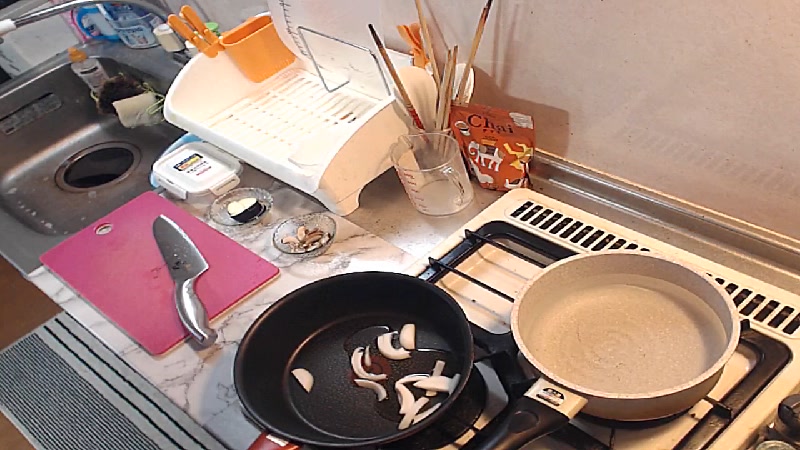
Image resolution: width=800 pixels, height=450 pixels. I want to click on floor, so click(x=17, y=312).